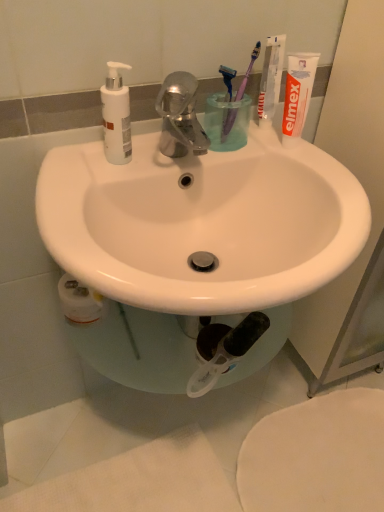
The height and width of the screenshot is (512, 384). Find the location of `vacant space to the right of white matte pump bottle at upper left`. vacant space to the right of white matte pump bottle at upper left is located at coordinates tap(183, 155).